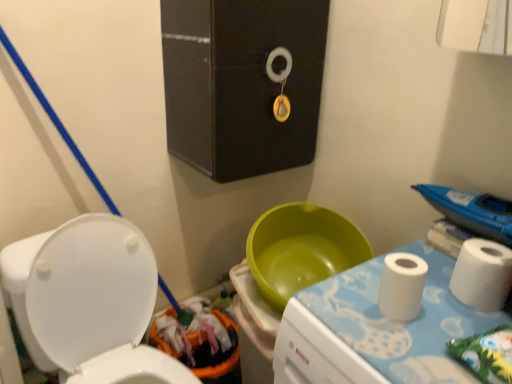
The image size is (512, 384). What are the coordinates of `free point in front of white matte toilet paper at right` in the screenshot? It's located at (403, 348).